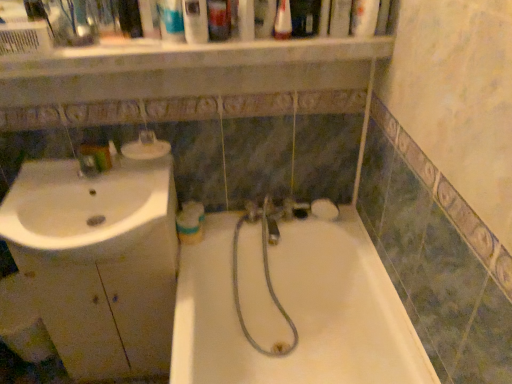
What are the coordinates of `vacant space positioned to the left of matte plastic container at upper left, the second toiletry from the front` in the screenshot? It's located at click(71, 181).